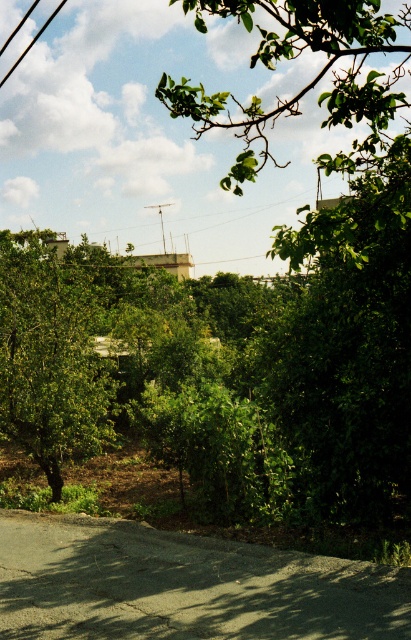
Question: Is green leafy tree at left below metallic pole at center?

Choices:
 (A) no
 (B) yes

Answer: (B)

Question: Does green leafy tree at left have a larger size compared to metallic pole at center?

Choices:
 (A) no
 (B) yes

Answer: (B)

Question: Can you confirm if green leafy tree at left is smaller than metallic pole at center?

Choices:
 (A) yes
 (B) no

Answer: (B)

Question: Which object appears farthest from the camera in this image?

Choices:
 (A) metallic pole at center
 (B) green leafy tree at left

Answer: (A)

Question: Which of the following is the farthest from the observer?

Choices:
 (A) metallic pole at center
 (B) green leafy tree at left

Answer: (A)